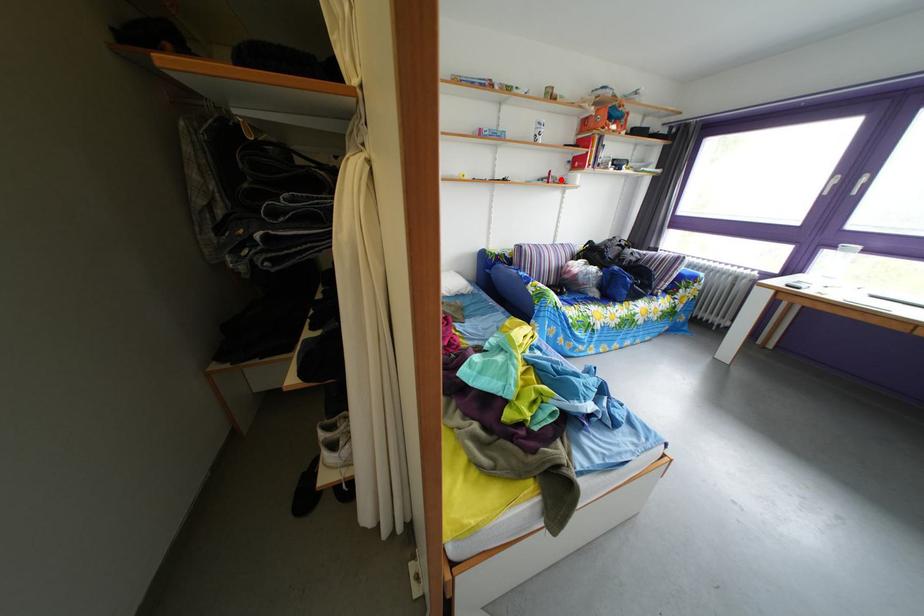
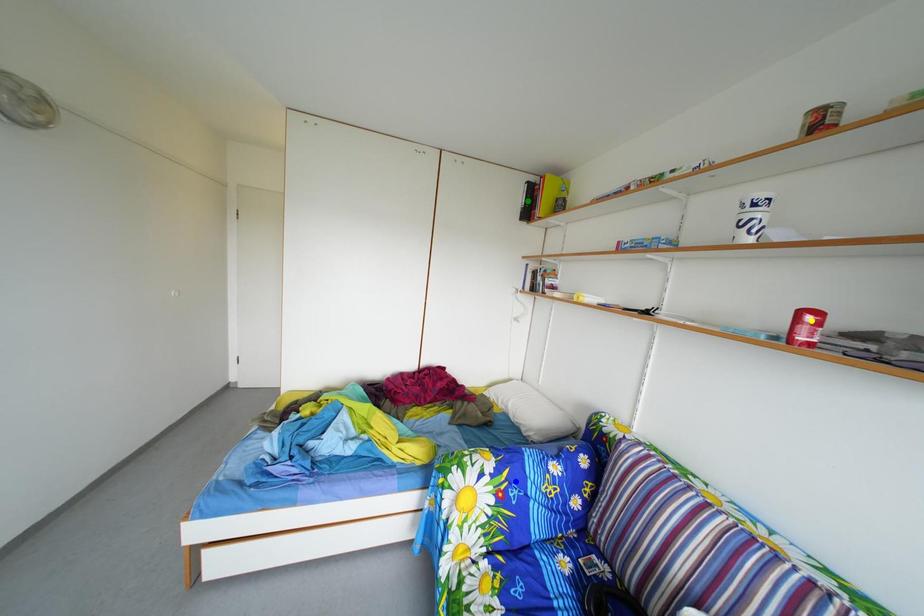
Question: I am providing you with two images of the same scene from different viewpoints. A red point is marked on the first image. You are given multiple points on the second image. Which point in image 2 is actually the same real-world point as the red point in image 1?

Choices:
 (A) yellow point
 (B) green point
 (C) blue point

Answer: (A)